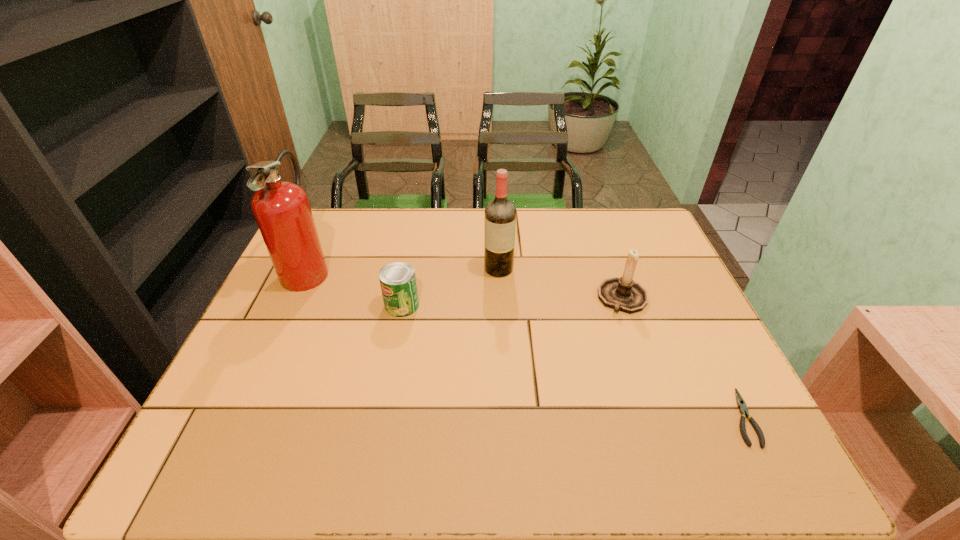
Where is `free region that satisfies the following two spatial constraints: 1. with the handle and nozzle on the tallest object; 2. on the back side of the second object from right to left`? free region that satisfies the following two spatial constraints: 1. with the handle and nozzle on the tallest object; 2. on the back side of the second object from right to left is located at coordinates (294, 298).

The width and height of the screenshot is (960, 540). I want to click on vacant area that satisfies the following two spatial constraints: 1. on the front-facing side of the second tallest object; 2. with the handle and nozzle on the leftmost object, so click(498, 269).

Identify the location of free spot that satisfies the following two spatial constraints: 1. with the handle and nozzle on the leftmost object; 2. on the back side of the third shortest object. The width and height of the screenshot is (960, 540). (294, 298).

Locate an element on the screen. The width and height of the screenshot is (960, 540). vacant position in the image that satisfies the following two spatial constraints: 1. with the handle and nozzle on the second shortest object; 2. on the right side of the leftmost object is located at coordinates (291, 305).

Identify the location of vacant area that satisfies the following two spatial constraints: 1. on the front-facing side of the shortest object; 2. on the right side of the liquor. Image resolution: width=960 pixels, height=540 pixels. 506,417.

The height and width of the screenshot is (540, 960). Identify the location of free space that satisfies the following two spatial constraints: 1. with the handle and nozzle on the leftmost object; 2. on the left side of the third shortest object. (294, 298).